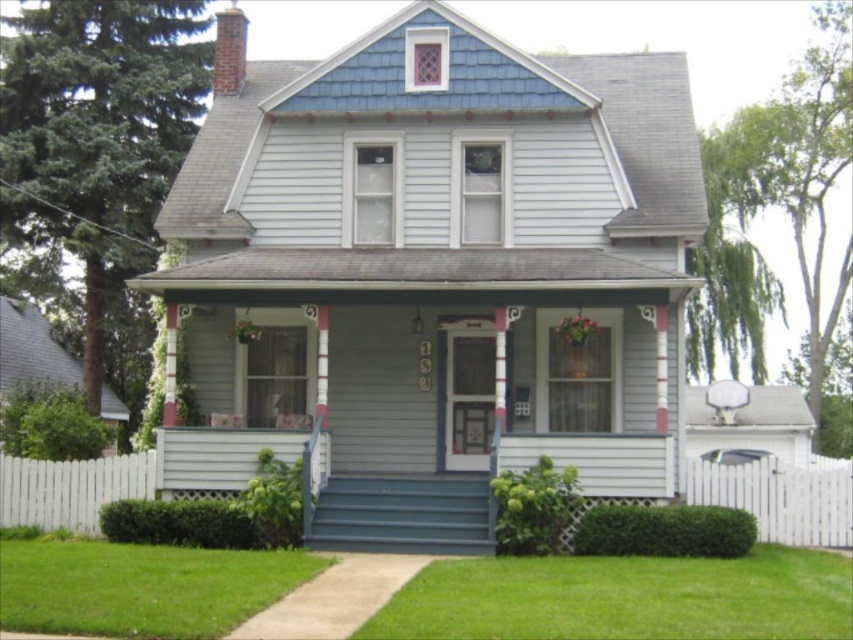
You are standing at the entrance of the house and want to walk towards the point labeled as point (9, 541). Which direction should you face to move towards it from the point labeled point (555, 608)?

To move from point (555, 608) to point (9, 541), you should face downward because point (9, 541) is below point (555, 608).